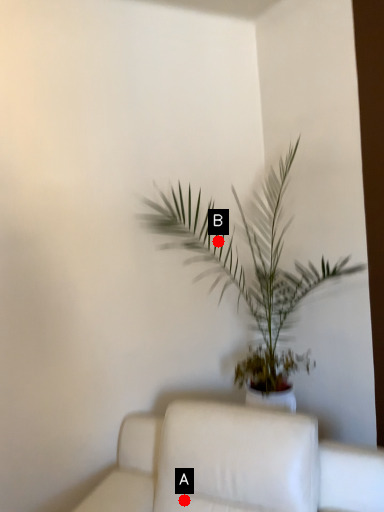
Question: Two points are circled on the image, labeled by A and B beside each circle. Among these points, which one is nearest to the camera?

Choices:
 (A) A is closer
 (B) B is closer

Answer: (A)